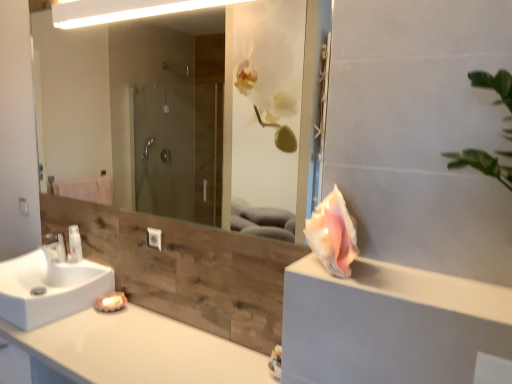
I want to click on free area below pink shell at right (from a real-world perspective), so click(x=334, y=269).